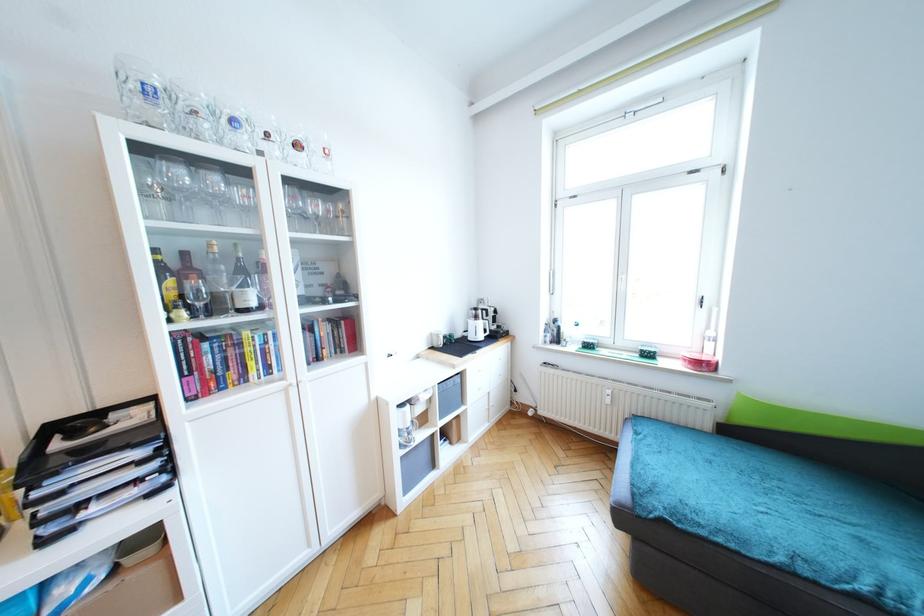
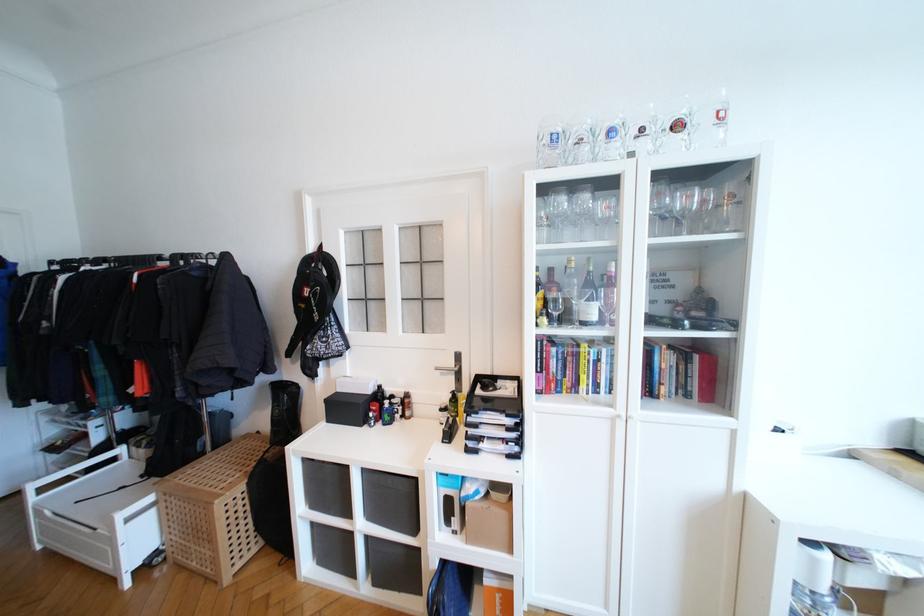
Where in the second image is the point corresponding to point 241,260 from the first image?

(591, 273)